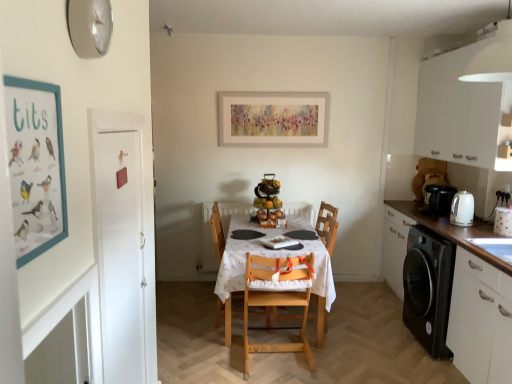
The image size is (512, 384). I want to click on vacant space situated above black plastic coffee machine at right (from a real-world perspective), so click(x=445, y=183).